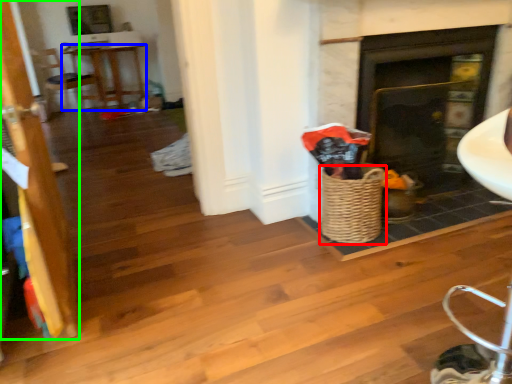
Question: Which object is positioned farthest from basket (highlighted by a red box)? Select from table (highlighted by a blue box) and door (highlighted by a green box).

Choices:
 (A) table
 (B) door

Answer: (A)